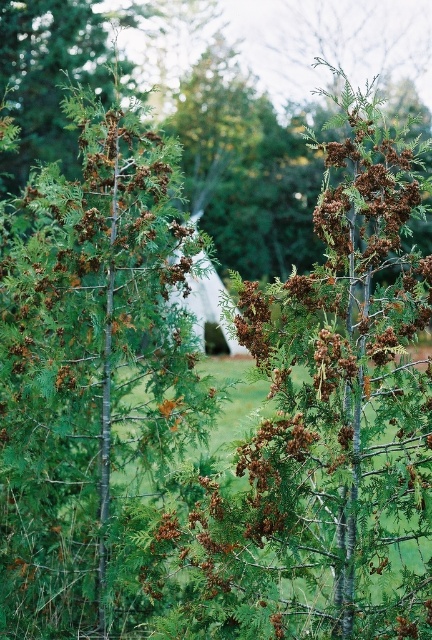
Question: Is brown textured tree at center bigger than green matte tree at center?

Choices:
 (A) no
 (B) yes

Answer: (B)

Question: Observing the image, what is the correct spatial positioning of brown textured tree at center in reference to green matte tree at center?

Choices:
 (A) left
 (B) right

Answer: (B)

Question: Which point is closer to the camera?

Choices:
 (A) (82, 540)
 (B) (405, 445)

Answer: (B)

Question: Which of the following is the farthest from the observer?

Choices:
 (A) (406, 268)
 (B) (22, 198)

Answer: (B)

Question: Considering the relative positions of brown textured tree at center and green matte tree at center in the image provided, where is brown textured tree at center located with respect to green matte tree at center?

Choices:
 (A) right
 (B) left

Answer: (A)